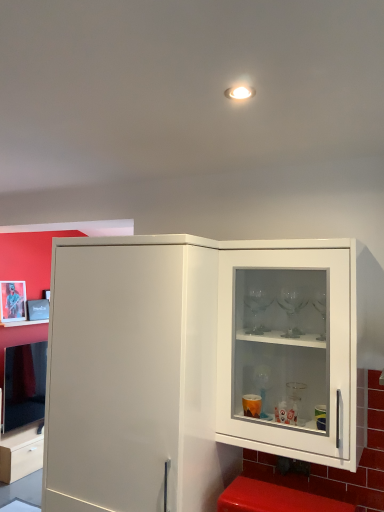
Question: Could you tell me if white glossy cabinet at right is facing metallic silver picture frame at upper left?

Choices:
 (A) no
 (B) yes

Answer: (A)

Question: Considering the relative positions of white glossy cabinet at right and metallic silver picture frame at upper left in the image provided, is white glossy cabinet at right behind metallic silver picture frame at upper left?

Choices:
 (A) no
 (B) yes

Answer: (A)

Question: Considering the relative positions of white glossy cabinet at right and metallic silver picture frame at upper left in the image provided, is white glossy cabinet at right to the right of metallic silver picture frame at upper left from the viewer's perspective?

Choices:
 (A) yes
 (B) no

Answer: (A)

Question: Is white glossy cabinet at right with metallic silver picture frame at upper left?

Choices:
 (A) yes
 (B) no

Answer: (B)

Question: From a real-world perspective, is white glossy cabinet at right under metallic silver picture frame at upper left?

Choices:
 (A) yes
 (B) no

Answer: (B)

Question: In terms of height, does red plastic step stool at lower right look taller or shorter compared to metallic silver picture frame at upper left?

Choices:
 (A) short
 (B) tall

Answer: (A)

Question: From a real-world perspective, is red plastic step stool at lower right above or below metallic silver picture frame at upper left?

Choices:
 (A) above
 (B) below

Answer: (B)

Question: Based on their sizes in the image, would you say red plastic step stool at lower right is bigger or smaller than metallic silver picture frame at upper left?

Choices:
 (A) big
 (B) small

Answer: (A)

Question: Is red plastic step stool at lower right situated inside metallic silver picture frame at upper left or outside?

Choices:
 (A) inside
 (B) outside

Answer: (B)

Question: Considering the positions of white glossy cabinet at right and red plastic step stool at lower right in the image, is white glossy cabinet at right bigger or smaller than red plastic step stool at lower right?

Choices:
 (A) small
 (B) big

Answer: (B)

Question: Does point (244, 399) appear closer or farther from the camera than point (297, 502)?

Choices:
 (A) closer
 (B) farther

Answer: (B)

Question: Choose the correct answer: Is white glossy cabinet at right inside red plastic step stool at lower right or outside it?

Choices:
 (A) outside
 (B) inside

Answer: (A)

Question: In the image, is white glossy cabinet at right positioned in front of or behind red plastic step stool at lower right?

Choices:
 (A) front
 (B) behind

Answer: (B)

Question: Based on their sizes in the image, would you say metallic silver picture frame at upper left is bigger or smaller than white glossy cabinet at right?

Choices:
 (A) small
 (B) big

Answer: (A)

Question: From the image's perspective, is metallic silver picture frame at upper left positioned above or below white glossy cabinet at right?

Choices:
 (A) above
 (B) below

Answer: (B)